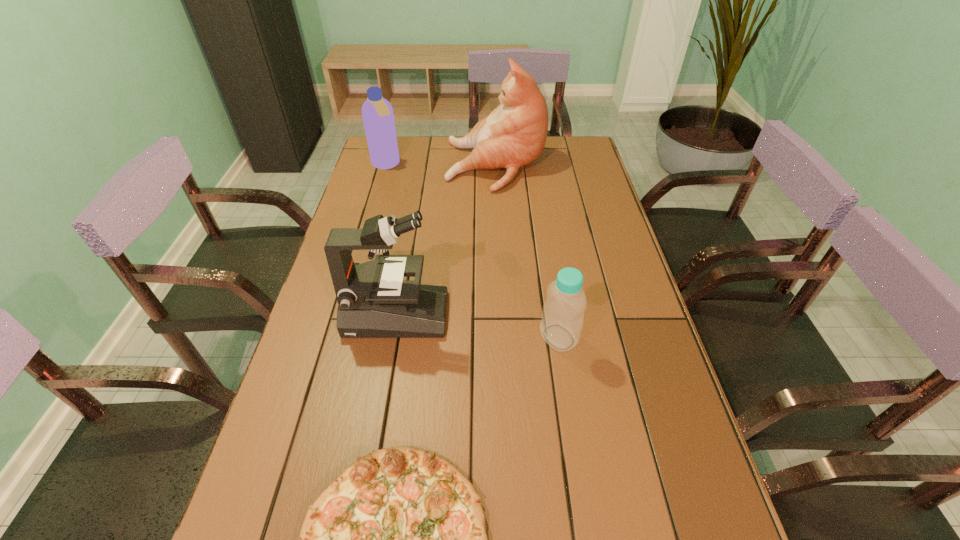
You are a GUI agent. You are given a task and a screenshot of the screen. Output one action in this format:
    pyautogui.click(x=<x>, y=<y>)
    Task: Click on the cat that is at the far edge
    
    Given the screenshot: What is the action you would take?
    coord(514,134)

This screenshot has height=540, width=960. I want to click on shampoo that is at the far edge, so click(377, 112).

This screenshot has width=960, height=540. I want to click on microscope located at the left edge, so click(x=374, y=301).

I want to click on shampoo that is positioned at the left edge, so click(x=377, y=112).

You are a GUI agent. You are given a task and a screenshot of the screen. Output one action in this format:
    pyautogui.click(x=<x>, y=<y>)
    Task: Click on the object that is at the far left corner
    Image resolution: width=960 pixels, height=540 pixels.
    Given the screenshot: What is the action you would take?
    pyautogui.click(x=377, y=112)

The image size is (960, 540). In order to click on vacant space at the left edge of the desktop in this screenshot , I will do `click(318, 329)`.

Locate an element on the screen. The image size is (960, 540). free region at the right edge of the desktop is located at coordinates (598, 251).

I want to click on blank area at the far right corner, so click(x=555, y=162).

The image size is (960, 540). Identify the location of vacant area between the fourth tallest object and the cat. (527, 251).

This screenshot has width=960, height=540. In order to click on free spot between the bottle and the cat in this screenshot , I will do `click(527, 251)`.